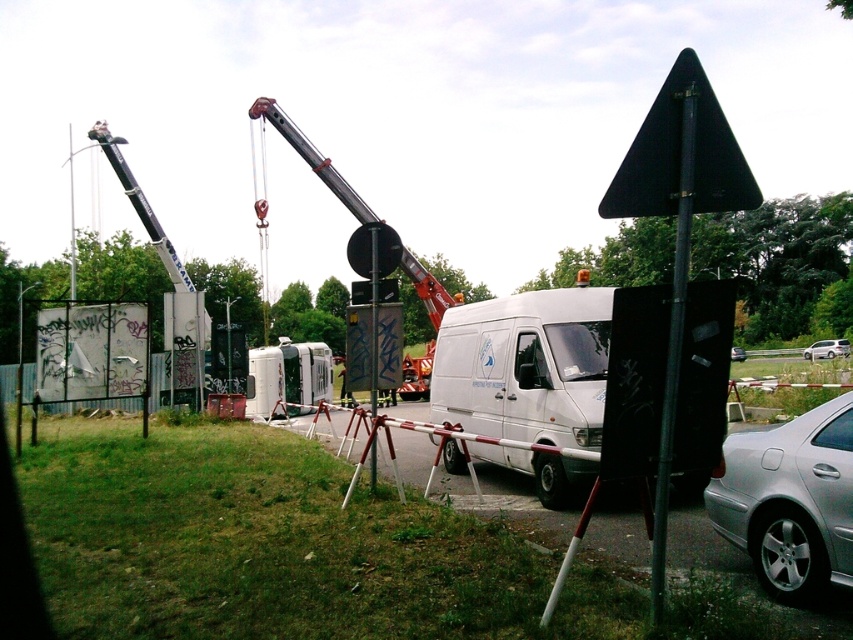
Question: Does black matte triangle at upper center appear under black metal pole at center right?

Choices:
 (A) yes
 (B) no

Answer: (B)

Question: Estimate the real-world distances between objects in this image. Which object is closer to the black matte triangle at upper center?

Choices:
 (A) metallic silver crane at center
 (B) silver metallic car at center
 (C) silver metallic car at lower right
 (D) white matte van at center

Answer: (C)

Question: Among these points, which one is farthest from the camera?

Choices:
 (A) (740, 355)
 (B) (747, 470)
 (C) (354, 204)

Answer: (A)

Question: Which point appears closest to the camera in this image?

Choices:
 (A) (769, 506)
 (B) (670, 433)
 (C) (432, 278)
 (D) (695, 433)

Answer: (B)

Question: Can you confirm if black matte triangle at upper center is thinner than metallic silver crane at center?

Choices:
 (A) yes
 (B) no

Answer: (A)

Question: Is metallic silver crane at center in front of silver metallic car at right?

Choices:
 (A) yes
 (B) no

Answer: (A)